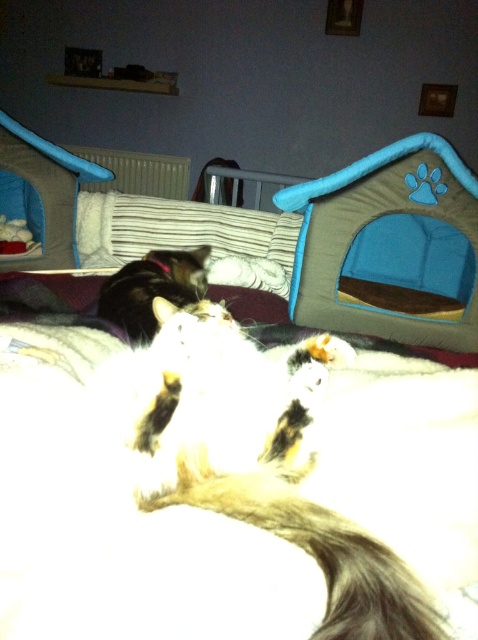
Consider the image. You are a photographer setting up a camera to capture the two cats on the bed. You have two points marked in the scene for focus adjustments. The first point is at coordinate point (296, 502) and the second is at point (441, 141). Which point should you focus on to ensure the closest cat to the camera is in sharp focus?

Point (296, 502) is closer to the viewer than point (441, 141), so focusing on point (296, 502) will ensure the closest cat is in sharp focus.

You are a photographer trying to capture the white fluffy cat at center. Based on the coordinates provided in the scene description, where should you position your camera to ensure the cat is centered in your shot?

The white fluffy cat at center is located at point (x=256, y=460), so you should position your camera to aim directly at those coordinates to center the cat in your shot.

You are a cat owner who wants to place a new toy between the white fluffy cat at center and the portable pet house to the right. The toy requires 30 centimeters of space to be placed safely. Can you fit the toy between them?

The distance of white fluffy cat at center from viewer is 29.19 centimeters, but the distance between the cat and the portable pet house is not provided. Therefore, it is impossible to determine if the toy can fit.